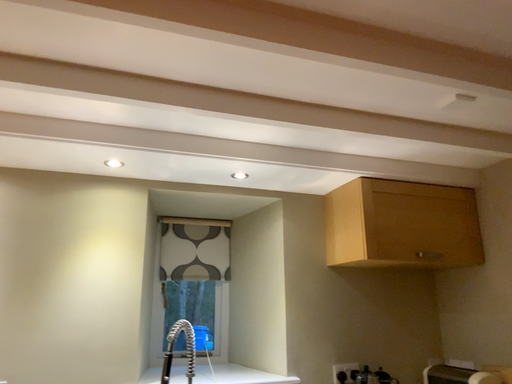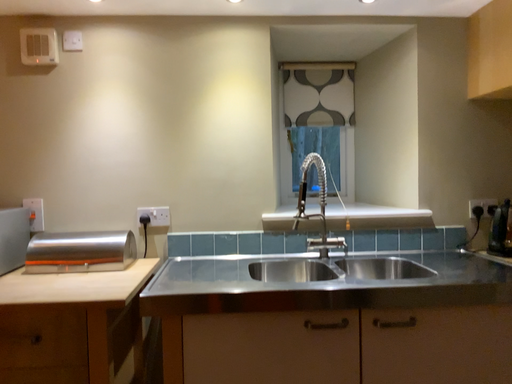
Question: How did the camera likely rotate when shooting the video?

Choices:
 (A) rotated upward
 (B) rotated downward

Answer: (B)